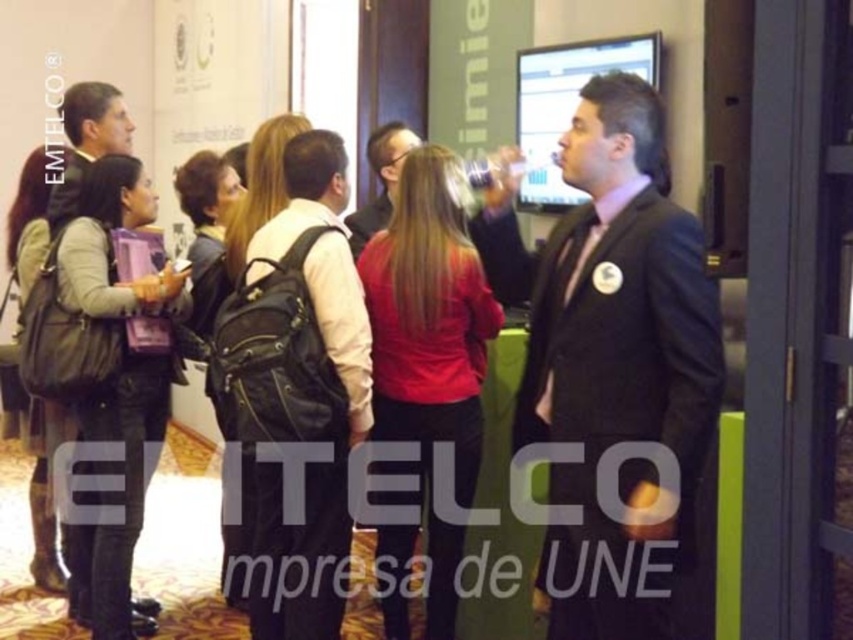
Who is taller, black suit at center or red matte jacket at center?

With more height is red matte jacket at center.

Consider the image. Is black suit at center positioned at the back of red matte jacket at center?

No, it is in front of red matte jacket at center.

Describe the element at coordinates (619, 355) in the screenshot. I see `black suit at center` at that location.

Find the location of a particular element. The width and height of the screenshot is (853, 640). black suit at center is located at coordinates (619, 355).